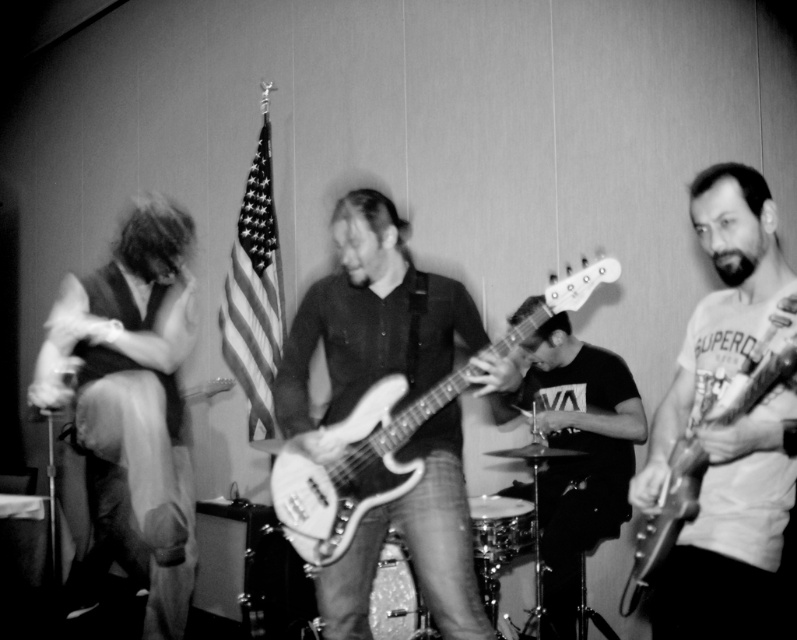
Can you confirm if smooth fabric shirt at left is positioned to the right of metallic silver guitar at right?

No, smooth fabric shirt at left is not to the right of metallic silver guitar at right.

Is point (108, 339) positioned after point (658, 499)?

Yes, it is.

This screenshot has height=640, width=797. What do you see at coordinates (134, 388) in the screenshot?
I see `smooth fabric shirt at left` at bounding box center [134, 388].

Identify the location of smooth fabric shirt at left. Image resolution: width=797 pixels, height=640 pixels. (134, 388).

Between smooth black shirt at center and metallic silver guitar at right, which one appears on the right side from the viewer's perspective?

metallic silver guitar at right is more to the right.

Is smooth black shirt at center above metallic silver guitar at right?

No.

Where is `smooth black shirt at center`? This screenshot has width=797, height=640. smooth black shirt at center is located at coordinates (576, 458).

Identify the location of smooth black shirt at center. This screenshot has height=640, width=797. (576, 458).

Can you confirm if metallic white bass guitar at center is positioned below metallic silver guitar at right?

Incorrect, metallic white bass guitar at center is not positioned below metallic silver guitar at right.

Does metallic white bass guitar at center appear over metallic silver guitar at right?

Yes, metallic white bass guitar at center is above metallic silver guitar at right.

Which is in front, point (383, 408) or point (689, 460)?

Point (689, 460)

I want to click on metallic white bass guitar at center, so click(355, 465).